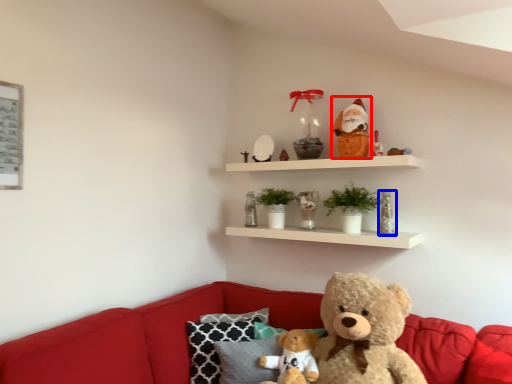
Question: Among these objects, which one is farthest to the camera, santa claus (highlighted by a red box) or toy (highlighted by a blue box)?

Choices:
 (A) santa claus
 (B) toy

Answer: (A)